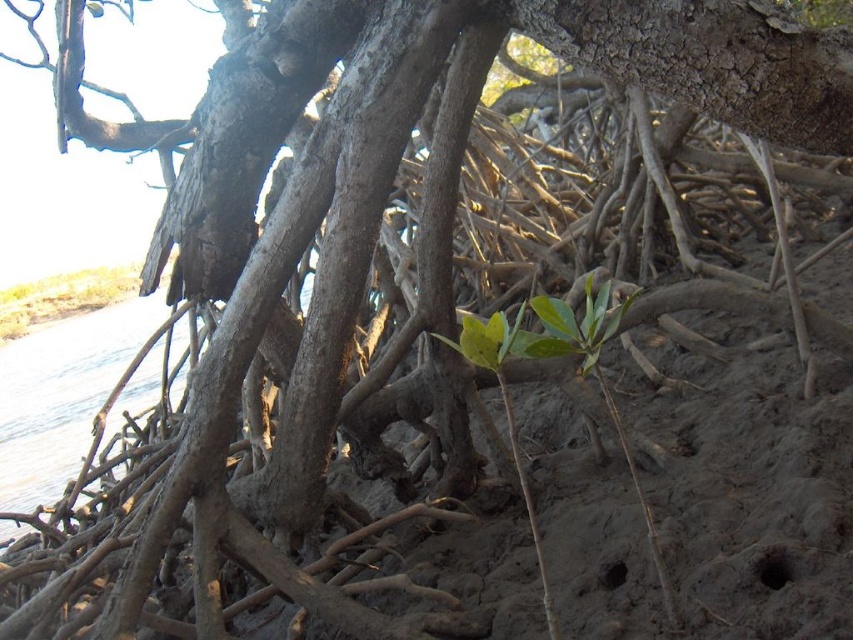
Question: Which point is closer to the camera taking this photo?

Choices:
 (A) (115, 268)
 (B) (78, 336)

Answer: (B)

Question: Among these objects, which one is farthest from the camera?

Choices:
 (A) green leafy plant at upper left
 (B) clear water at lower left

Answer: (A)

Question: Does clear water at lower left appear under green leafy plant at upper left?

Choices:
 (A) yes
 (B) no

Answer: (A)

Question: Does clear water at lower left have a lesser width compared to green leafy plant at upper left?

Choices:
 (A) no
 (B) yes

Answer: (A)

Question: Can you confirm if clear water at lower left is positioned to the right of green leafy plant at upper left?

Choices:
 (A) no
 (B) yes

Answer: (B)